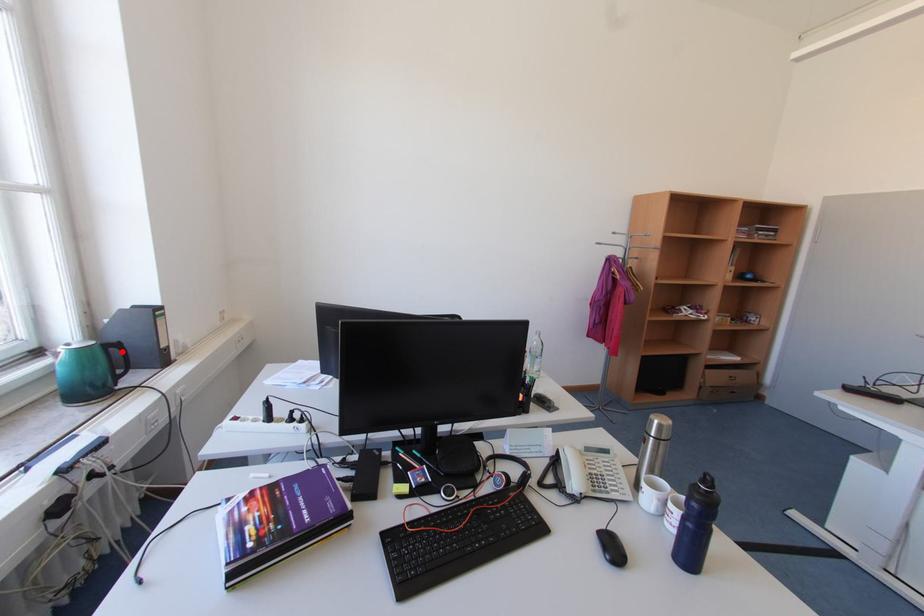
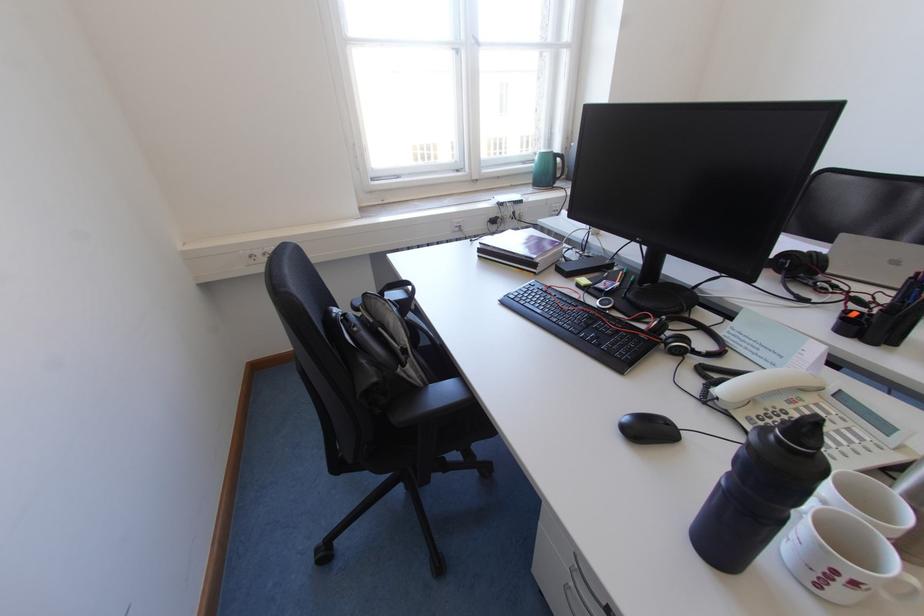
Question: A red point is marked in image1. In image2, is the corresponding 3D point closer to the camera or farther? Reply with the corresponding letter.

Choices:
 (A) The corresponding 3D point is closer.
 (B) The corresponding 3D point is farther.

Answer: (A)